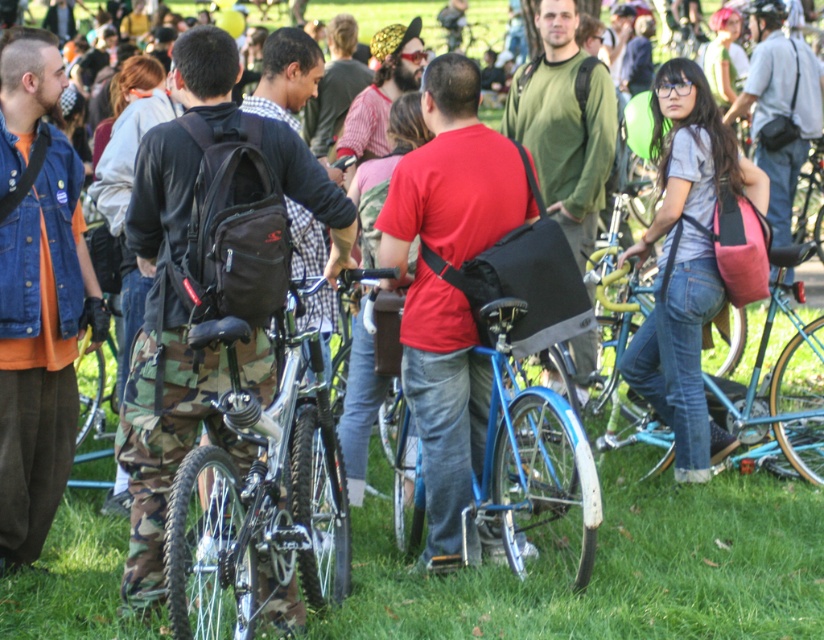
Looking at this image, you are standing in the park and see the green grass at center and the matte black backpack at center. Which object is positioned to the right of the other?

The green grass at center is to the right of the matte black backpack at center.

You are standing in the park and see the green grass at center and the denim jeans at center. Which object is located to the left?

The green grass at center is positioned on the left side of denim jeans at center.

You are a photographer at the event and want to capture a clear shot of the denim jeans at center. Since the green grass at center might block the view, can you confirm if the grass is shorter than the jeans?

The green grass at center is not as tall as denim jeans at center, so yes, the grass is shorter and won